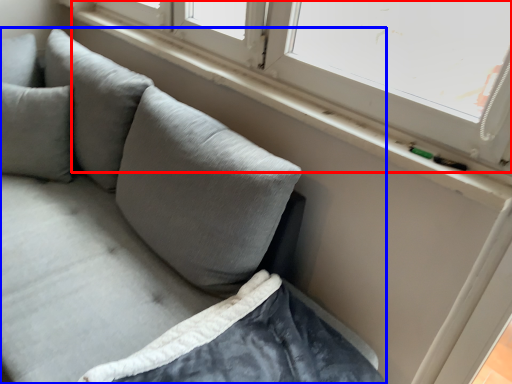
Question: Which object appears closest to the camera in this image, window (highlighted by a red box) or studio couch (highlighted by a blue box)?

Choices:
 (A) window
 (B) studio couch

Answer: (B)